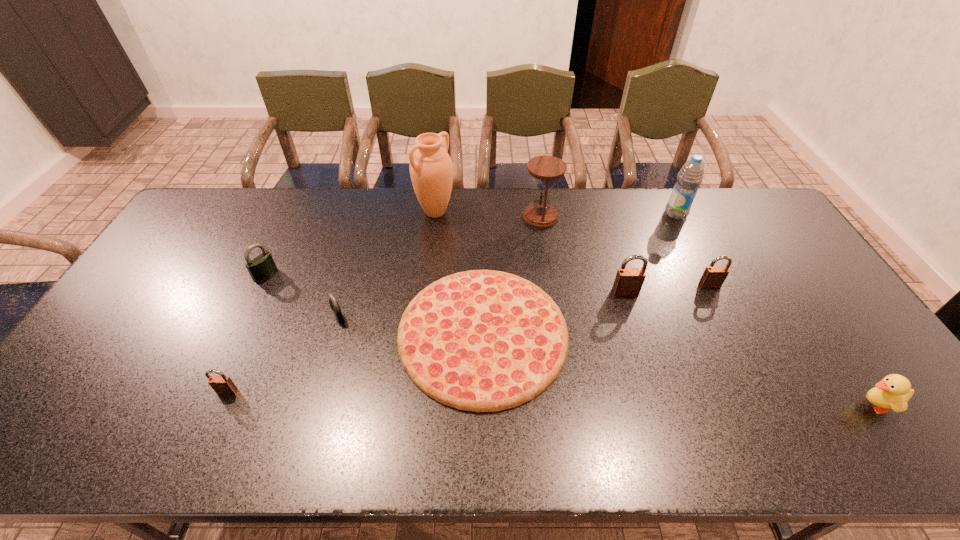
The height and width of the screenshot is (540, 960). Find the location of `vacant space in between the hourglass and the left black padlock`. vacant space in between the hourglass and the left black padlock is located at coordinates (403, 246).

Locate an element on the screen. This screenshot has width=960, height=540. free space between the third padlock from left to right and the nearest brown padlock is located at coordinates (283, 354).

Find the location of a particular element. This screenshot has width=960, height=540. vacant space that is in between the rightmost object and the rightmost brown padlock is located at coordinates (792, 345).

You are a GUI agent. You are given a task and a screenshot of the screen. Output one action in this format:
    pyautogui.click(x=<x>, y=<y>)
    Task: Click on the free spot between the eighth object from right to left and the hourglass
    Image resolution: width=960 pixels, height=540 pixels.
    Given the screenshot: What is the action you would take?
    pyautogui.click(x=440, y=267)

The image size is (960, 540). What are the coordinates of `blank region between the nearer black padlock and the nearest brown padlock` in the screenshot? It's located at (283, 354).

Identify the location of free point between the duckling and the rightmost padlock. This screenshot has height=540, width=960. (792, 345).

The image size is (960, 540). I want to click on vacant area that lies between the farther black padlock and the urn, so click(350, 243).

This screenshot has height=540, width=960. Identify the location of the ninth closest object to the nearest brown padlock. (893, 392).

Locate which object is the sixth closest to the second brown padlock from left to right. Please provide its 2D coordinates. Your answer should be formatted as a tuple, i.e. [(x, y)], where the tuple contains the x and y coordinates of a point satisfying the conditions above.

[(431, 169)]

Select which padlock is the fifth closest to the yellow duckling. Please provide its 2D coordinates. Your answer should be formatted as a tuple, i.e. [(x, y)], where the tuple contains the x and y coordinates of a point satisfying the conditions above.

[(262, 266)]